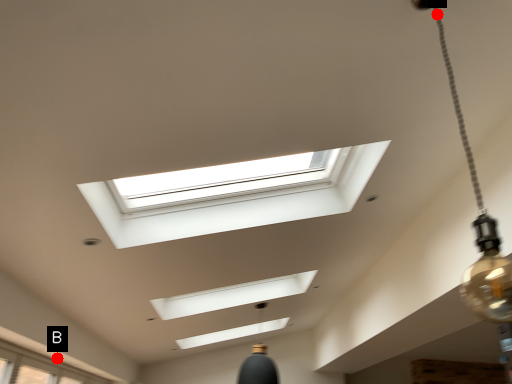
Question: Two points are circled on the image, labeled by A and B beside each circle. Among these points, which one is farthest from the camera?

Choices:
 (A) A is further
 (B) B is further

Answer: (B)